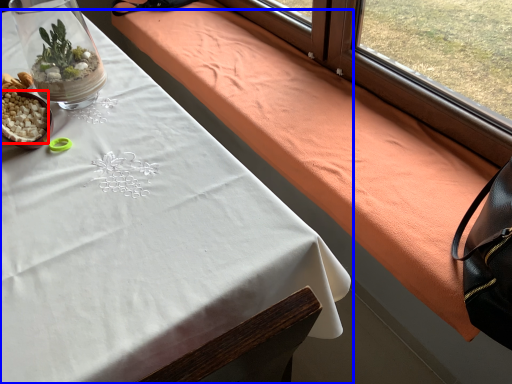
Question: Which object appears closest to the camera in this image, food (highlighted by a red box) or table (highlighted by a blue box)?

Choices:
 (A) food
 (B) table

Answer: (B)